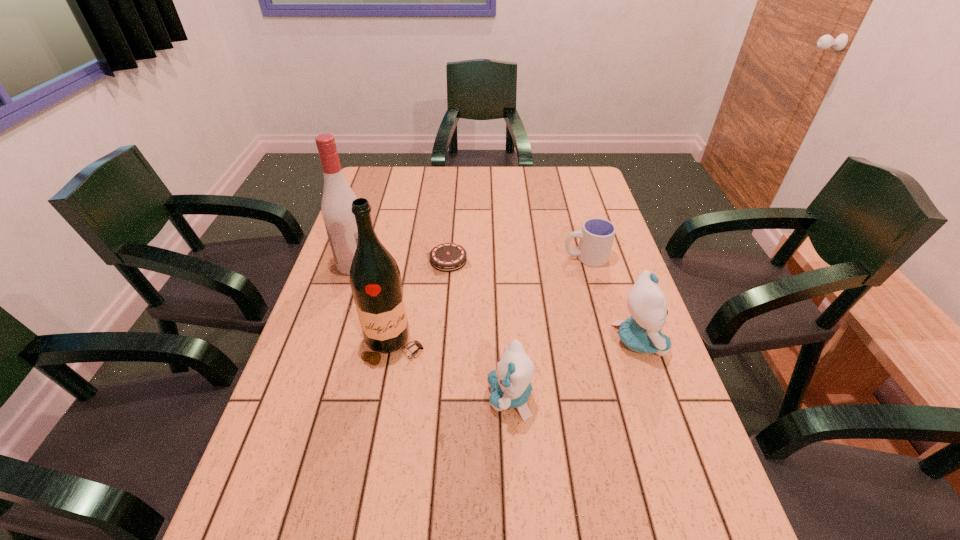
I want to click on cup that is at the right edge, so click(597, 235).

Find the location of a particular element. The image size is (960, 540). free space at the far edge of the desktop is located at coordinates (421, 193).

Where is `free region at the near edge of the desktop`? The width and height of the screenshot is (960, 540). free region at the near edge of the desktop is located at coordinates (524, 502).

In order to click on free space at the left edge of the desktop in this screenshot , I will do `click(385, 215)`.

This screenshot has width=960, height=540. Find the location of `free region at the right edge of the desktop`. free region at the right edge of the desktop is located at coordinates (614, 269).

In the image, there is a desktop. In order to click on vacant space at the far right corner in this screenshot , I will do `click(569, 187)`.

At what (x,y) coordinates should I click in order to perform the action: click on vacant area that lies between the shortest object and the alcohol. Please return your answer as a coordinate pair (x, y). The height and width of the screenshot is (540, 960). Looking at the image, I should click on (401, 262).

Where is `vacant space that's between the wine bottle and the cup`? This screenshot has height=540, width=960. vacant space that's between the wine bottle and the cup is located at coordinates (491, 301).

The width and height of the screenshot is (960, 540). I want to click on vacant area between the shorter kitten and the chocolate cake, so click(479, 329).

Locate an element on the screen. The height and width of the screenshot is (540, 960). vacant point located between the wine bottle and the chocolate cake is located at coordinates [421, 302].